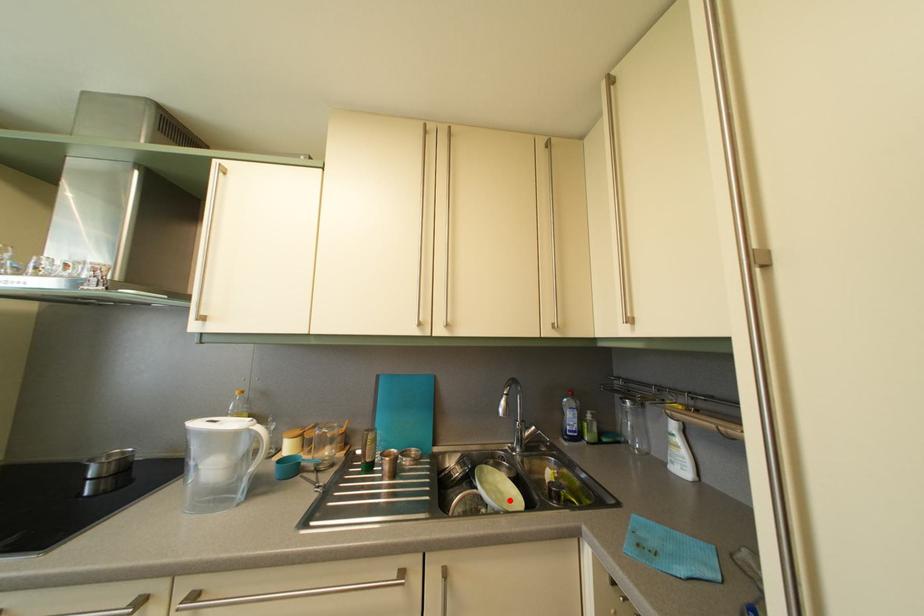
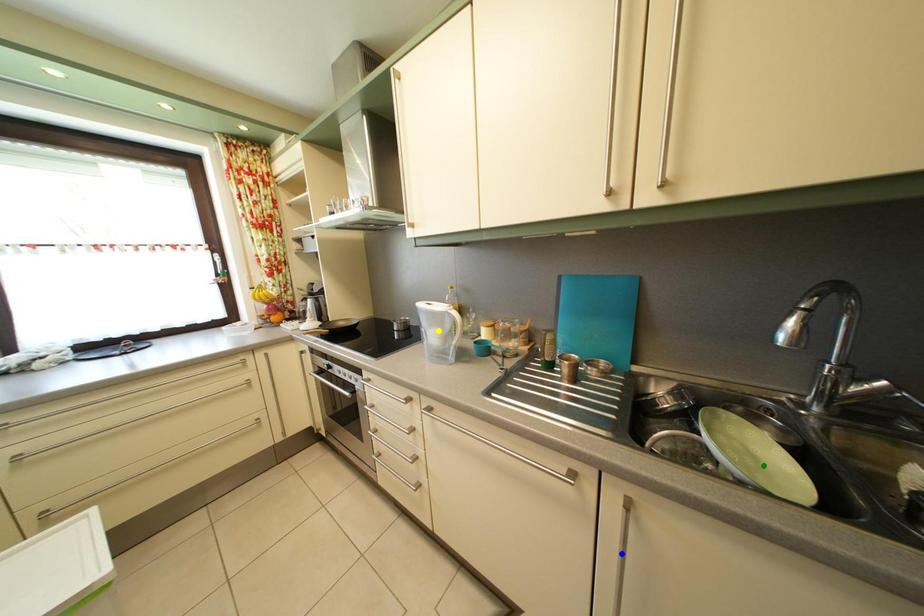
Question: I am providing you with two images of the same scene from different viewpoints. A red point is marked on the first image. You are given multiple points on the second image. Can you choose the point in image 2 that corresponds to the point in image 1?

Choices:
 (A) yellow point
 (B) blue point
 (C) green point

Answer: (C)